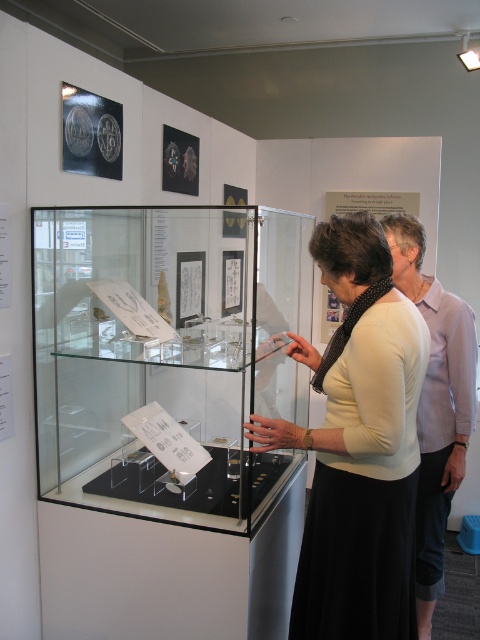
Which is behind, point (43, 433) or point (396, 236)?

Point (396, 236)

Which is below, clear glass case at center or light purple shirt at right?

light purple shirt at right is below.

Does point (182, 480) come closer to viewer compared to point (437, 554)?

That is True.

The image size is (480, 640). In order to click on clear glass case at center in this screenshot , I will do `click(168, 356)`.

Which is above, white matte sweater at center or light purple shirt at right?

white matte sweater at center is above.

Based on the photo, can you confirm if white matte sweater at center is bigger than light purple shirt at right?

Correct, white matte sweater at center is larger in size than light purple shirt at right.

Which is behind, point (350, 272) or point (446, 451)?

The point (446, 451) is more distant.

This screenshot has height=640, width=480. What are the coordinates of `white matte sweater at center` in the screenshot? It's located at (358, 445).

Who is lower down, clear glass case at center or white matte sweater at center?

white matte sweater at center is below.

Does clear glass case at center have a lesser width compared to white matte sweater at center?

No.

Does point (105, 460) come in front of point (365, 492)?

No, it is behind (365, 492).

I want to click on clear glass case at center, so click(168, 356).